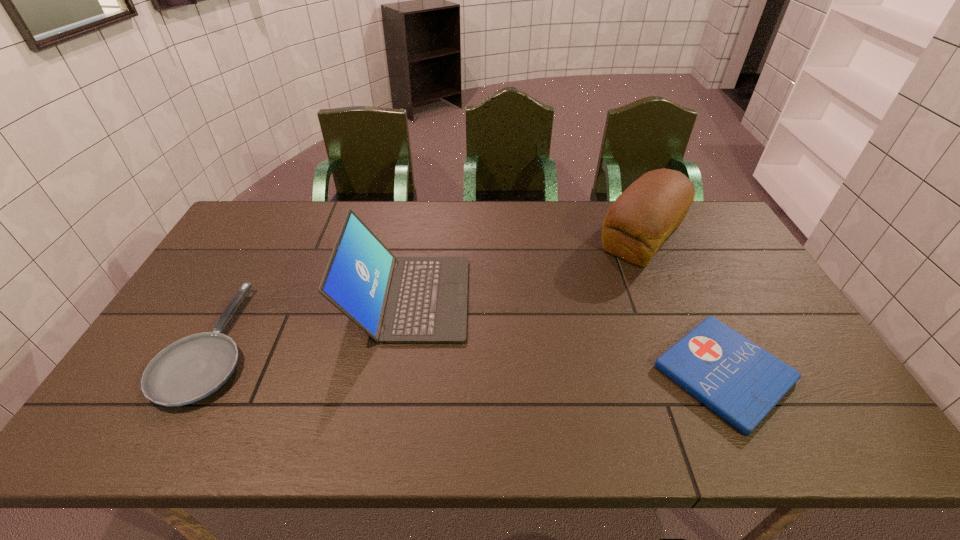
Image resolution: width=960 pixels, height=540 pixels. I want to click on vacant region between the second object from left to right and the bread, so [525, 268].

This screenshot has height=540, width=960. Identify the location of empty space that is in between the shortest object and the third tallest object. (468, 358).

The height and width of the screenshot is (540, 960). I want to click on the closest object to the first-aid kit, so click(x=639, y=221).

Image resolution: width=960 pixels, height=540 pixels. What are the coordinates of `object that is the third nearest to the bread` in the screenshot? It's located at (192, 368).

Identify the location of free space that satisfies the following two spatial constraints: 1. on the screen of the laptop computer; 2. on the right side of the shortest object. (396, 373).

Where is `free location that satisfies the following two spatial constraints: 1. on the screen of the shortest object; 2. on the left side of the second object from left to right`? free location that satisfies the following two spatial constraints: 1. on the screen of the shortest object; 2. on the left side of the second object from left to right is located at coordinates (396, 373).